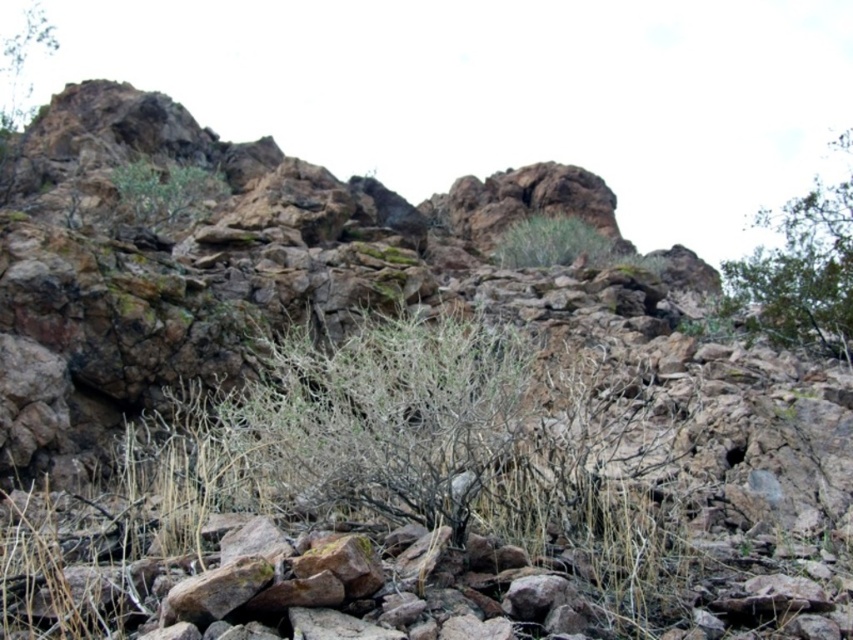
Question: Can you confirm if green leafy bush at upper center is wider than green grass at upper center?

Choices:
 (A) no
 (B) yes

Answer: (B)

Question: Does green leafy bush at upper center have a larger size compared to green grass at upper center?

Choices:
 (A) yes
 (B) no

Answer: (A)

Question: Among these points, which one is nearest to the camera?

Choices:
 (A) (213, 196)
 (B) (595, 240)

Answer: (A)

Question: Does green leafy bush at upper center appear under green grass at upper center?

Choices:
 (A) yes
 (B) no

Answer: (B)